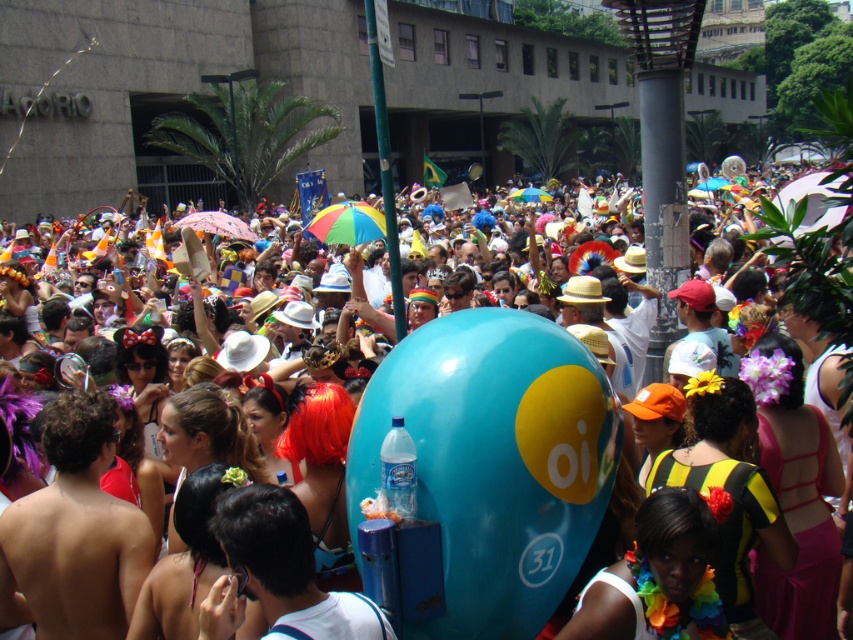
Question: Among these points, which one is farthest from the camera?

Choices:
 (A) (630, 572)
 (B) (523, 454)

Answer: (B)

Question: Which point is closer to the camera?

Choices:
 (A) multicolored fabric lei at center
 (B) blue glossy balloon at center

Answer: (A)

Question: Where is blue glossy balloon at center located in relation to multicolored fabric lei at center in the image?

Choices:
 (A) right
 (B) left

Answer: (B)

Question: Is blue glossy balloon at center wider than multicolored fabric lei at center?

Choices:
 (A) yes
 (B) no

Answer: (A)

Question: Which of the following is the farthest from the observer?

Choices:
 (A) blue glossy balloon at center
 (B) multicolored fabric lei at center

Answer: (A)

Question: From the image, what is the correct spatial relationship of blue glossy balloon at center in relation to multicolored fabric lei at center?

Choices:
 (A) above
 (B) below

Answer: (A)